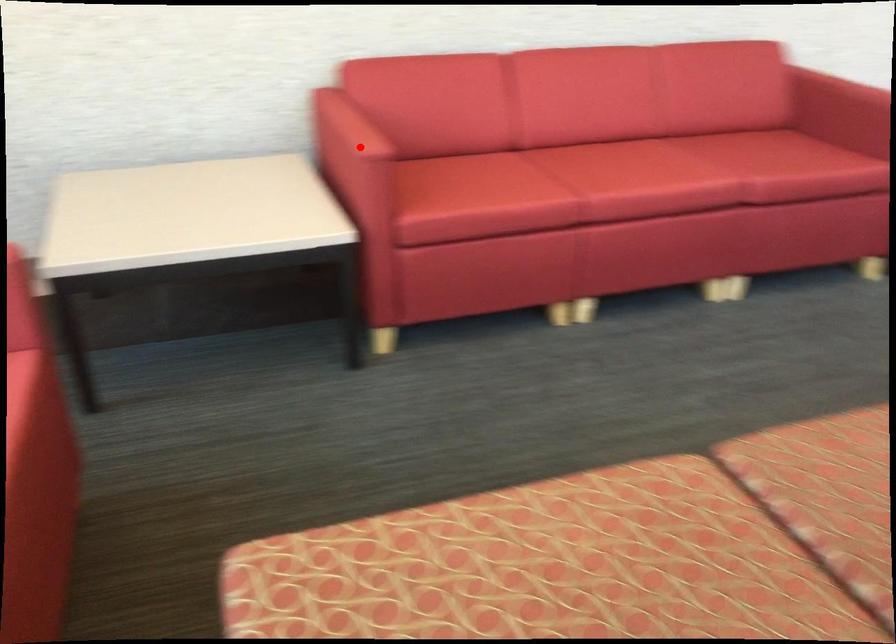
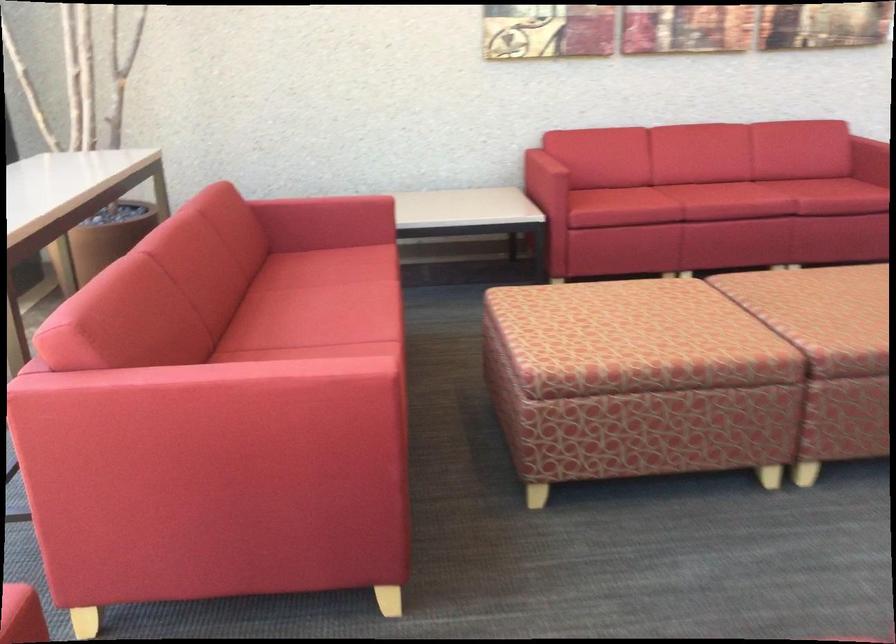
Question: A red point is marked in image1. In image2, is the corresponding 3D point closer to the camera or farther? Reply with the corresponding letter.

Choices:
 (A) The corresponding 3D point is closer.
 (B) The corresponding 3D point is farther.

Answer: (B)